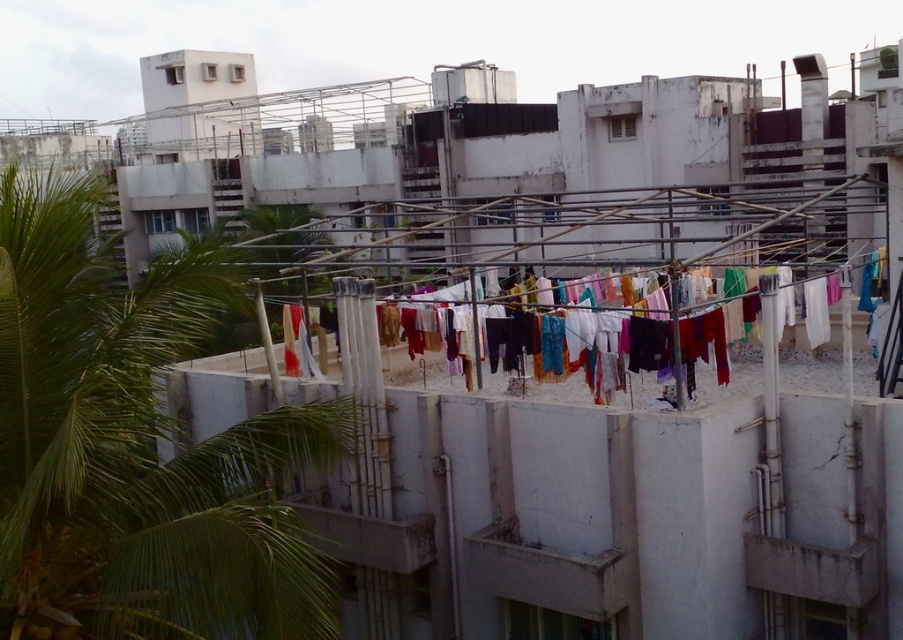
You are standing on a rooftop and want to take a photo of the point at coordinates (x=273, y=520). If your camera has a focal length of 50mm and you need to be at least 25 feet away to avoid distortion, will you need to move closer or farther away?

The point at coordinates (x=273, y=520) is 26.99 feet away from the camera. Since 26.99 feet is more than the required 25 feet distance to avoid distortion, you do not need to move. You can stay at your current position.

You are standing on the rooftop and want to place a new potted plant exactly at the center of the rooftop. The current green leafy palm tree at upper left is located at point 0.700, 0.153. Can you determine if the palm tree is closer to the left edge or the right edge of the rooftop?

The green leafy palm tree at upper left is located at point (137, 448). Since the x coordinate is 0.700, which is closer to the right edge of the rooftop, the palm tree is closer to the right edge than the left edge.

You are a window cleaner who needs to reach the highest point between the green leafy palm tree at upper left and the multicolored fabric at center. Which object should you target first?

The green leafy palm tree at upper left has a greater height compared to the multicolored fabric at center, so you should target the green leafy palm tree at upper left first as it is taller.